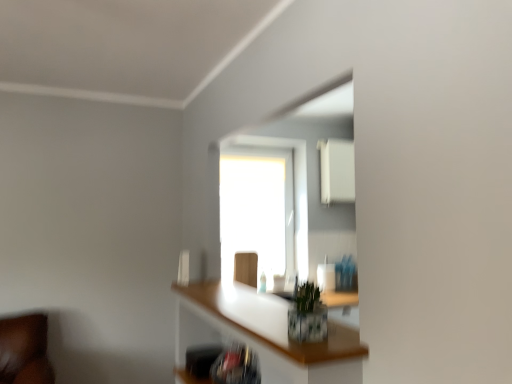
The image size is (512, 384). Find the location of `free space that is to the left of green leafy plant at center`. free space that is to the left of green leafy plant at center is located at coordinates (268, 331).